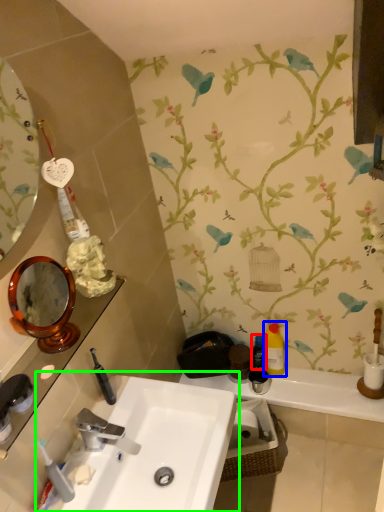
Question: Estimate the real-world distances between objects in this image. Which object is closer to mouthwash (highlighted by a red box), mouthwash (highlighted by a blue box) or sink (highlighted by a green box)?

Choices:
 (A) mouthwash
 (B) sink

Answer: (A)